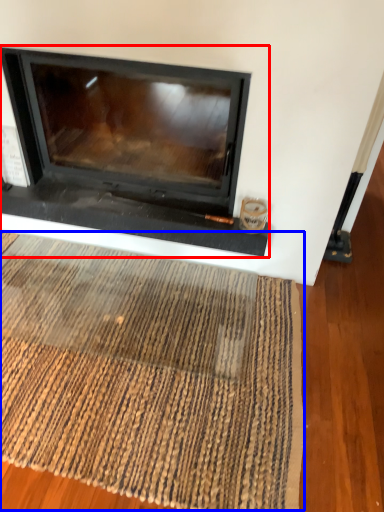
Question: Which point is further to the camera, fireplace (highlighted by a red box) or mat (highlighted by a blue box)?

Choices:
 (A) fireplace
 (B) mat

Answer: (A)